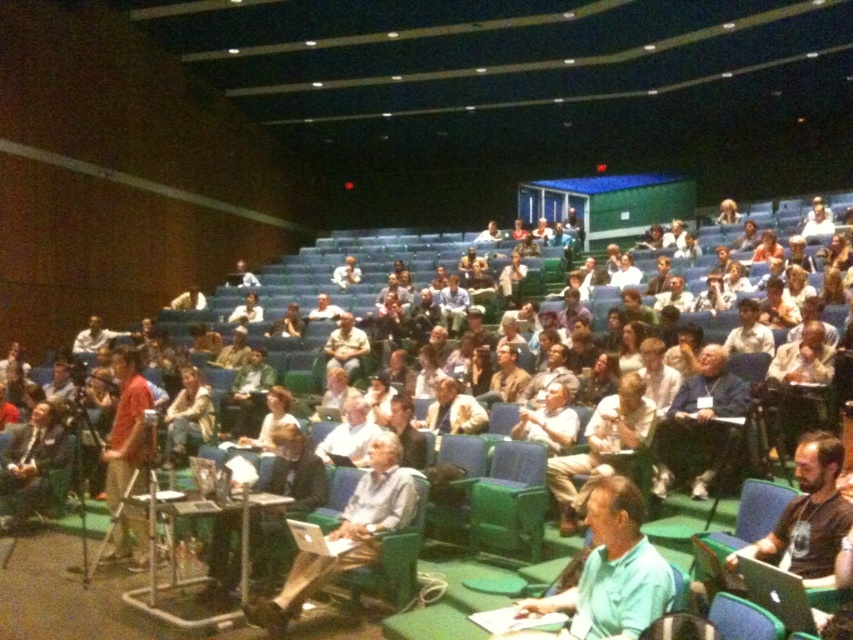
Is point (585, 573) closer to viewer compared to point (132, 444)?

Yes.

Is point (585, 608) closer to viewer compared to point (117, 358)?

Yes, it is.

What are the coordinates of `green matte shirt at center` in the screenshot? It's located at (608, 573).

Measure the distance from matte orange shirt at center to light brown leather jacket at center.

The distance of matte orange shirt at center from light brown leather jacket at center is 7.46 meters.

Which of these two, matte orange shirt at center or light brown leather jacket at center, stands shorter?

Standing shorter between the two is light brown leather jacket at center.

Which is in front, point (115, 476) or point (335, 269)?

Point (115, 476) is in front.

Where is `matte orange shirt at center`? matte orange shirt at center is located at coordinates (126, 426).

Does green matte shirt at center appear under light brown leather jacket at lower left?

Incorrect, green matte shirt at center is not positioned below light brown leather jacket at lower left.

Is green matte shirt at center bigger than light brown leather jacket at lower left?

No, green matte shirt at center is not bigger than light brown leather jacket at lower left.

Where is `green matte shirt at center`? green matte shirt at center is located at coordinates (608, 573).

You are a GUI agent. You are given a task and a screenshot of the screen. Output one action in this format:
    pyautogui.click(x=<x>, y=<y>)
    Task: Click on the green matte shirt at center
    This screenshot has width=853, height=640.
    Given the screenshot: What is the action you would take?
    pyautogui.click(x=608, y=573)